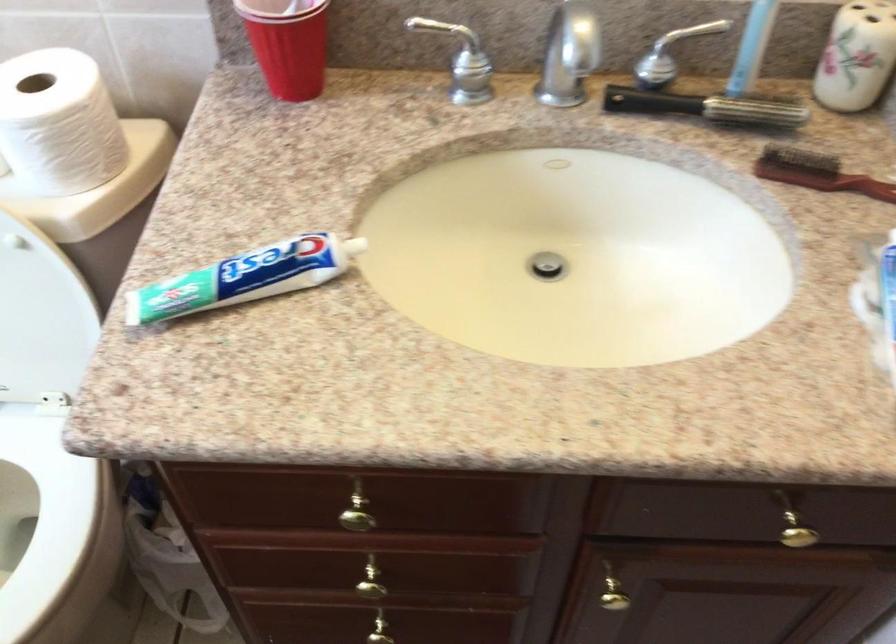
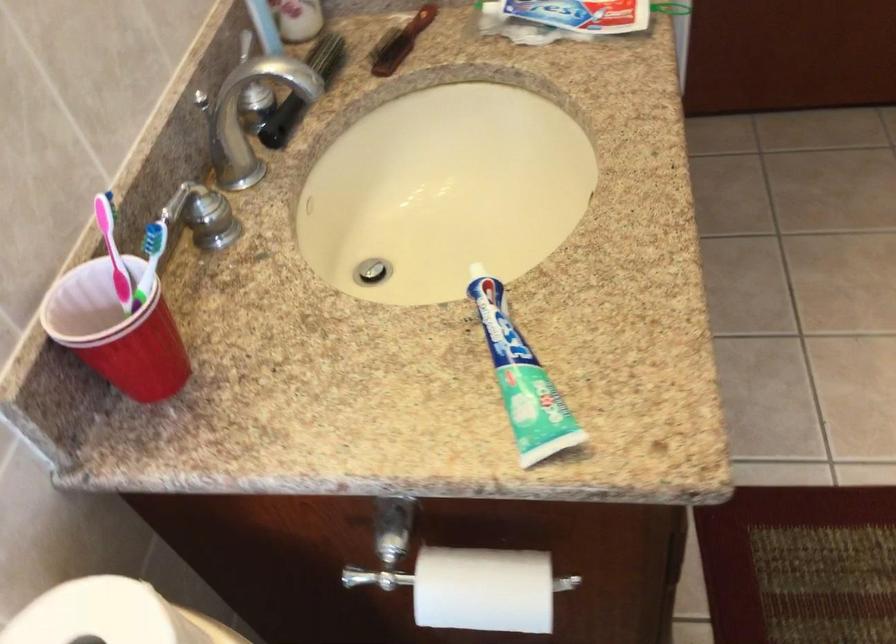
The point at (x=200, y=277) is marked in the first image. Where is the corresponding point in the second image?

(521, 379)